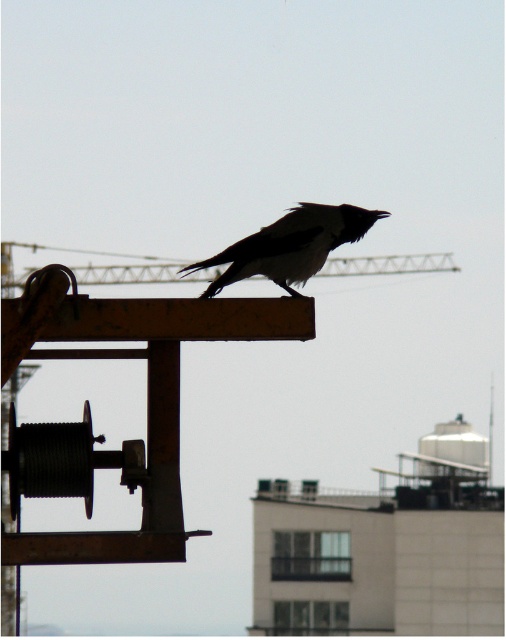
Question: Where is black matte bird at center located in relation to metallic gray crane at center in the image?

Choices:
 (A) right
 (B) left

Answer: (B)

Question: Among these objects, which one is nearest to the camera?

Choices:
 (A) metallic gray crane at center
 (B) black matte bird at center

Answer: (A)

Question: From the image, what is the correct spatial relationship of black matte bird at center in relation to metallic gray crane at center?

Choices:
 (A) below
 (B) above

Answer: (A)

Question: Is black matte bird at center thinner than metallic gray crane at center?

Choices:
 (A) no
 (B) yes

Answer: (B)

Question: Which of the following is the closest to the observer?

Choices:
 (A) (202, 298)
 (B) (126, 273)

Answer: (A)